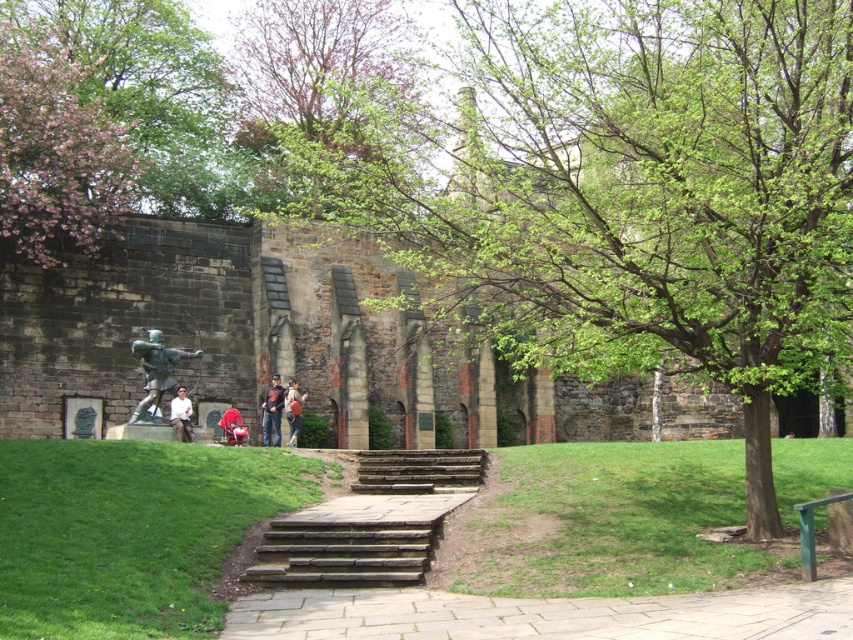
Is green grass at lower right taller than brown stone stairs at center?

No, green grass at lower right is not taller than brown stone stairs at center.

Can you confirm if green grass at lower right is thinner than brown stone stairs at center?

No, green grass at lower right is not thinner than brown stone stairs at center.

Which is in front, point (792, 460) or point (263, 580)?

Point (263, 580)

Locate an element on the screen. The image size is (853, 640). green grass at lower right is located at coordinates (602, 522).

This screenshot has height=640, width=853. What do you see at coordinates (131, 531) in the screenshot?
I see `green grass at lower left` at bounding box center [131, 531].

Is point (126, 456) less distant than point (651, 525)?

No, it is not.

I want to click on green grass at lower left, so click(131, 531).

The image size is (853, 640). I want to click on green grass at lower left, so click(131, 531).

Can you confirm if green grass at lower right is positioned above bronze statue at center?

No.

Is point (448, 556) positioned after point (148, 372)?

No, it is not.

Between point (527, 550) and point (158, 404), which one is positioned in front?

Positioned in front is point (527, 550).

Locate an element on the screen. green grass at lower right is located at coordinates (602, 522).